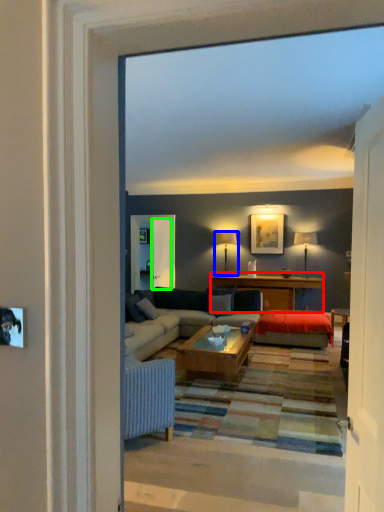
Question: Which is farther away from table (highlighted by a red box)? lamp (highlighted by a blue box) or screen door (highlighted by a green box)?

Choices:
 (A) lamp
 (B) screen door

Answer: (B)